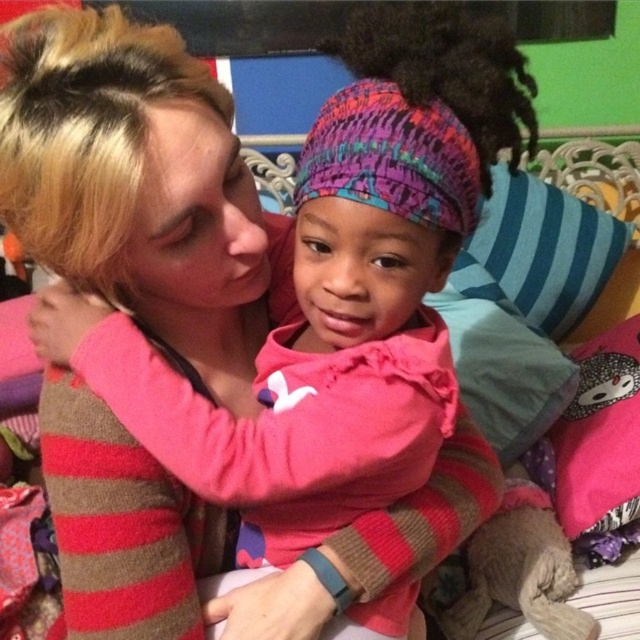
Is point (481, 285) positioned after point (576, 515)?

Yes.

Does point (541, 237) come farther from viewer compared to point (637, 324)?

Yes, point (541, 237) is farther from viewer.

This screenshot has height=640, width=640. Find the location of `blue striped pillow at right`. blue striped pillow at right is located at coordinates (540, 252).

Based on the photo, can you confirm if pink fleece at center is smaller than pink fabric pillow at lower right?

No.

Who is higher up, pink fleece at center or pink fabric pillow at lower right?

Positioned higher is pink fleece at center.

The height and width of the screenshot is (640, 640). What are the coordinates of `pink fleece at center` in the screenshot? It's located at (314, 339).

I want to click on pink fleece at center, so click(x=314, y=339).

Is pink fleece at center shorter than blue striped pillow at right?

No.

What do you see at coordinates (314, 339) in the screenshot?
I see `pink fleece at center` at bounding box center [314, 339].

The width and height of the screenshot is (640, 640). What are the coordinates of `pink fleece at center` in the screenshot? It's located at (314, 339).